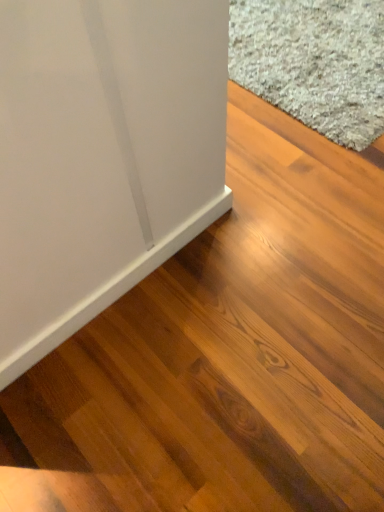
Locate an element on the screen. The height and width of the screenshot is (512, 384). blank space situated above white matte baseboard at lower left (from a real-world perspective) is located at coordinates (115, 275).